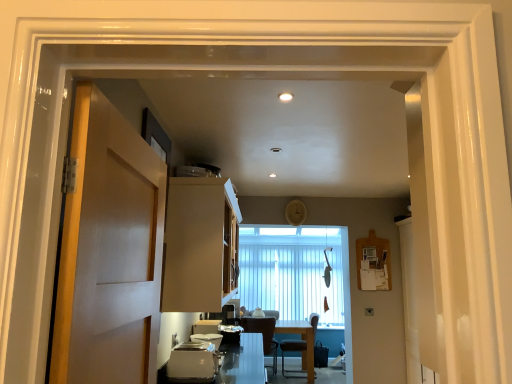
The height and width of the screenshot is (384, 512). Describe the element at coordinates (208, 339) in the screenshot. I see `satin silver toaster at lower center` at that location.

Where is `dark brown leather chair at center, acting as the second chair starting from the left`? dark brown leather chair at center, acting as the second chair starting from the left is located at coordinates (294, 351).

What do you see at coordinates (243, 361) in the screenshot? I see `white glossy countertop at lower center` at bounding box center [243, 361].

This screenshot has width=512, height=384. I want to click on white glossy countertop at lower center, so click(x=243, y=361).

The image size is (512, 384). I want to click on wooden chair at center, which appears as the 2th chair when viewed from the right, so click(263, 334).

Measure the distance between wooden chair at center, which appears as the 2th chair when viewed from the right, and white blinds at center.

The distance of wooden chair at center, which appears as the 2th chair when viewed from the right, from white blinds at center is 34.78 inches.

Is point (265, 334) less distant than point (308, 272)?

That is True.

Considering their positions, is wooden chair at center, which appears as the 2th chair when viewed from the right, located in front of or behind white blinds at center?

In the image, wooden chair at center, which appears as the 2th chair when viewed from the right, appears in front of white blinds at center.

Can you confirm if wooden chair at center, which appears as the 2th chair when viewed from the right, is positioned to the left of white blinds at center?

Yes.

Does point (286, 376) come behind point (243, 339)?

Yes, point (286, 376) is farther from viewer.

From the image's perspective, between dark brown leather chair at center, acting as the second chair starting from the left, and white glossy countertop at lower center, who is located below?

dark brown leather chair at center, acting as the second chair starting from the left, from the image's perspective.

Which object is positioned more to the left, dark brown leather chair at center, which is the first chair from right to left, or white glossy countertop at lower center?

white glossy countertop at lower center.

What are the coordinates of `counter top above the dark brown leather chair at center, which is the first chair from right to left (from the image's perspective)` in the screenshot? It's located at (243, 361).

From the image's perspective, which is above, white blinds at center or matte wood cabinet at center?

From the image's view, matte wood cabinet at center is above.

I want to click on window on the right of the matte wood cabinet at center, so click(293, 272).

Which of these two, white blinds at center or matte wood cabinet at center, stands taller?

With more height is white blinds at center.

Where is `door above the dark brown leather chair at center, acting as the second chair starting from the left (from the image's perspective)`? Image resolution: width=512 pixels, height=384 pixels. door above the dark brown leather chair at center, acting as the second chair starting from the left (from the image's perspective) is located at coordinates (106, 244).

Is point (313, 314) farther from camera compared to point (121, 199)?

Yes.

Could you tell me if dark brown leather chair at center, acting as the second chair starting from the left, is turned towards matte white door at left?

No.

Looking at the image, does dark brown leather chair at center, which is the first chair from right to left, seem bigger or smaller compared to matte white door at left?

Clearly, dark brown leather chair at center, which is the first chair from right to left, is larger in size than matte white door at left.

Is satin silver toaster at lower center oriented away from matte white door at left?

That's not correct — satin silver toaster at lower center is not looking away from matte white door at left.

From the image's perspective, is satin silver toaster at lower center on top of matte white door at left?

No.

How many degrees apart are the facing directions of satin silver toaster at lower center and matte white door at left?

There is a 0.761-degree angle between the facing directions of satin silver toaster at lower center and matte white door at left.

In the scene shown: From a real-world perspective, is white blinds at center physically located above or below matte white door at left?

In terms of real-world spatial position, white blinds at center is below matte white door at left.

Is white blinds at center placed right next to matte white door at left?

No, white blinds at center is not with matte white door at left.

Is white blinds at center oriented away from matte white door at left?

white blinds at center does not have its back to matte white door at left.

In the scene shown: From the image's perspective, between white blinds at center and matte white door at left, who is located below?

From the image's view, white blinds at center is below.

In the scene shown: Could you tell me if white glossy countertop at lower center is turned towards dark brown leather chair at center, acting as the second chair starting from the left?

No, white glossy countertop at lower center is not aimed at dark brown leather chair at center, acting as the second chair starting from the left.

Would you say white glossy countertop at lower center is a long distance from dark brown leather chair at center, which is the first chair from right to left?

Yes, white glossy countertop at lower center is far from dark brown leather chair at center, which is the first chair from right to left.

Which is behind, point (254, 359) or point (298, 341)?

The point (298, 341) is behind.

Identify the location of window behind the wooden chair at center, the first chair from the left. (293, 272).

You are a GUI agent. You are given a task and a screenshot of the screen. Output one action in this format:
    pyautogui.click(x=<x>, y=<y>)
    Task: Click on the chair that is the 2nd object to the right of the white glossy countertop at lower center, starting at the anchor
    Image resolution: width=512 pixels, height=384 pixels.
    Given the screenshot: What is the action you would take?
    pyautogui.click(x=294, y=351)

Based on their spatial positions, is white glossy countertop at lower center or matte wood cabinet at center closer to dark brown leather chair at center, acting as the second chair starting from the left?

white glossy countertop at lower center is closer to dark brown leather chair at center, acting as the second chair starting from the left.

Looking at the image, which one is located closer to satin silver toaster at lower center, wooden chair at center, the first chair from the left, or matte white door at left?

matte white door at left.

Based on their spatial positions, is satin silver toaster at lower center or dark brown leather chair at center, acting as the second chair starting from the left, further from wooden chair at center, which appears as the 2th chair when viewed from the right?

satin silver toaster at lower center lies further to wooden chair at center, which appears as the 2th chair when viewed from the right, than the other object.

Consider the image. Which object lies nearer to the anchor point matte wood cabinet at center, white glossy countertop at lower center or wooden chair at center, which appears as the 2th chair when viewed from the right?

white glossy countertop at lower center lies closer to matte wood cabinet at center than the other object.

Considering their positions, is matte white door at left positioned further to dark brown leather chair at center, which is the first chair from right to left, than wooden chair at center, which appears as the 2th chair when viewed from the right?

matte white door at left is further to dark brown leather chair at center, which is the first chair from right to left.

Which object lies nearer to the anchor point dark brown leather chair at center, acting as the second chair starting from the left, satin silver toaster at lower center or white blinds at center?

white blinds at center lies closer to dark brown leather chair at center, acting as the second chair starting from the left, than the other object.

Estimate the real-world distances between objects in this image. Which object is further from matte white door at left, white blinds at center or matte wood cabinet at center?

white blinds at center is further to matte white door at left.

Considering their positions, is white glossy countertop at lower center positioned closer to matte white door at left than white blinds at center?

white glossy countertop at lower center is closer to matte white door at left.

Identify the location of counter top between satin silver toaster at lower center and dark brown leather chair at center, which is the first chair from right to left, from front to back. (243, 361).

I want to click on cabinetry positioned between matte white door at left and satin silver toaster at lower center from near to far, so click(x=200, y=244).

Locate an element on the screen. The image size is (512, 384). appliance between matte wood cabinet at center and white blinds at center in the front-back direction is located at coordinates (208, 339).

Identify the location of cabinetry between matte white door at left and wooden chair at center, the first chair from the left, in the front-back direction. (200, 244).